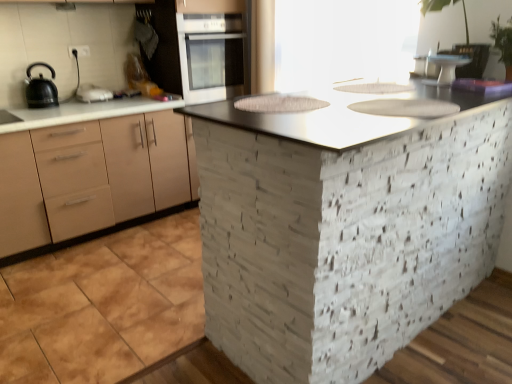
Measure the distance between green leafy plant at upper right and camera.

green leafy plant at upper right is 6.61 feet from camera.

Measure the distance between metallic gray countertop at center and camera.

They are 3.50 feet apart.

Find the location of `white glossy sink at upper center, which ranks as the second sink in bottom-to-top order`. white glossy sink at upper center, which ranks as the second sink in bottom-to-top order is located at coordinates (375, 88).

What do you see at coordinates (211, 56) in the screenshot?
I see `white glossy oven at upper center` at bounding box center [211, 56].

In order to click on white glossy sink at center, arranged as the first sink when ordered from the bottom in this screenshot , I will do `click(406, 107)`.

Considering the sizes of transparent glass window screen at upper center and green leafy plant at upper right in the image, is transparent glass window screen at upper center taller or shorter than green leafy plant at upper right?

Considering their sizes, transparent glass window screen at upper center has more height than green leafy plant at upper right.

Locate an element on the screen. plant that appears below the transparent glass window screen at upper center (from the image's perspective) is located at coordinates (461, 24).

Is transparent glass window screen at upper center beside green leafy plant at upper right?

No, transparent glass window screen at upper center is not next to green leafy plant at upper right.

Does transparent glass window screen at upper center appear on the right side of green leafy plant at upper right?

No, transparent glass window screen at upper center is not to the right of green leafy plant at upper right.

Is matte black kettle at left wider or thinner than white glossy cake stand at upper right?

matte black kettle at left is wider than white glossy cake stand at upper right.

Are matte black kettle at left and white glossy cake stand at upper right located far from each other?

matte black kettle at left is positioned a significant distance from white glossy cake stand at upper right.

From the image's perspective, is matte black kettle at left positioned above or below white glossy cake stand at upper right?

matte black kettle at left is above white glossy cake stand at upper right.

Considering the relative sizes of matte black kettle at left and white glossy cake stand at upper right in the image provided, is matte black kettle at left bigger than white glossy cake stand at upper right?

Yes.

In the scene shown: From a real-world perspective, is white glossy oven at upper center positioned above or below metallic gray countertop at center?

white glossy oven at upper center is situated higher than metallic gray countertop at center in the real world.

Relative to metallic gray countertop at center, is white glossy oven at upper center in front or behind?

In the image, white glossy oven at upper center appears behind metallic gray countertop at center.

Is white glossy oven at upper center facing towards metallic gray countertop at center?

Yes.

Can you confirm if white glossy oven at upper center is bigger than metallic gray countertop at center?

No.

Is point (438, 54) closer or farther from the camera than point (320, 134)?

Point (438, 54) is positioned farther from the camera compared to point (320, 134).

Is the depth of white glossy cake stand at upper right greater than that of metallic gray countertop at center?

Yes.

Who is smaller, white glossy cake stand at upper right or metallic gray countertop at center?

white glossy cake stand at upper right.

Are white glossy cake stand at upper right and metallic gray countertop at center beside each other?

No, white glossy cake stand at upper right is not in contact with metallic gray countertop at center.

Is matte beige cabinet at left a part of white glossy sink at upper center, placed as the first sink when sorted from top to bottom?

No, matte beige cabinet at left is not inside white glossy sink at upper center, placed as the first sink when sorted from top to bottom.

Is white glossy sink at upper center, the second sink in the front-to-back sequence, in front of or behind matte beige cabinet at left in the image?

Visually, white glossy sink at upper center, the second sink in the front-to-back sequence, is located in front of matte beige cabinet at left.

Is white glossy sink at upper center, the second sink in the front-to-back sequence, with matte beige cabinet at left?

No, white glossy sink at upper center, the second sink in the front-to-back sequence, is not next to matte beige cabinet at left.

Which is behind, point (323, 3) or point (34, 87)?

Positioned behind is point (34, 87).

Locate an element on the screen. The width and height of the screenshot is (512, 384). window screen above the black matte kettle at left (from the image's perspective) is located at coordinates (343, 41).

Is black matte kettle at left at the back of transparent glass window screen at upper center?

No, transparent glass window screen at upper center is not facing the opposite direction of black matte kettle at left.

Where is `oven above the matte black kettle at left (from a real-world perspective)`? oven above the matte black kettle at left (from a real-world perspective) is located at coordinates (211, 56).

Considering the sizes of objects white glossy oven at upper center and matte black kettle at left in the image provided, who is wider, white glossy oven at upper center or matte black kettle at left?

white glossy oven at upper center.

Which of these two, white glossy oven at upper center or matte black kettle at left, is bigger?

With larger size is white glossy oven at upper center.

Locate an element on the screen. This screenshot has width=512, height=384. plant located above the transparent glass window screen at upper center (from a real-world perspective) is located at coordinates (461, 24).

Locate an element on the screen. The height and width of the screenshot is (384, 512). kitchen appliance behind the white glossy cake stand at upper right is located at coordinates (92, 93).

Based on their spatial positions, is white glossy oven at upper center or matte beige cabinet at left closer to white glossy cake stand at upper right?

white glossy oven at upper center lies closer to white glossy cake stand at upper right than the other object.

From the picture: Considering their positions, is white glossy sink at upper center, placed as the first sink when sorted from top to bottom, positioned further to white glossy oven at upper center than metallic gray countertop at center?

Based on the image, metallic gray countertop at center appears to be further to white glossy oven at upper center.

In the scene shown: Considering their positions, is green leafy plant at upper right positioned further to matte black kettle at left than white glossy cake stand at upper right?

Among the two, green leafy plant at upper right is located further to matte black kettle at left.

Looking at the image, which one is located further to black matte kettle at left, white glossy sink at upper center, which ranks as the second sink in bottom-to-top order, or white glossy sink at center, placed as the 1th sink when sorted from front to back?

The object further to black matte kettle at left is white glossy sink at center, placed as the 1th sink when sorted from front to back.

Estimate the real-world distances between objects in this image. Which object is further from matte beige cabinet at left, white glossy sink at center, arranged as the first sink when ordered from the bottom, or white glossy sink at upper center, placed as the first sink when sorted from top to bottom?

Among the two, white glossy sink at center, arranged as the first sink when ordered from the bottom, is located further to matte beige cabinet at left.

When comparing their distances from matte beige cabinet at left, does white glossy cake stand at upper right or white glossy sink at upper center, the second sink in the front-to-back sequence, seem closer?

white glossy sink at upper center, the second sink in the front-to-back sequence, lies closer to matte beige cabinet at left than the other object.

Based on their spatial positions, is metallic gray countertop at center or white glossy sink at center, placed as the 1th sink when sorted from front to back, closer to green leafy plant at upper right?

white glossy sink at center, placed as the 1th sink when sorted from front to back, lies closer to green leafy plant at upper right than the other object.

Looking at the image, which one is located further to matte black kettle at left, white glossy cake stand at upper right or matte beige cabinet at left?

white glossy cake stand at upper right.

Identify the location of appliance between black matte kettle at left and green leafy plant at upper right in the horizontal direction. (446, 68).

The image size is (512, 384). Find the location of `window screen between matte black kettle at left and green leafy plant at upper right from left to right`. window screen between matte black kettle at left and green leafy plant at upper right from left to right is located at coordinates (x=343, y=41).

You are a GUI agent. You are given a task and a screenshot of the screen. Output one action in this format:
    pyautogui.click(x=<x>, y=<y>)
    Task: Click on the appliance between matte black kettle at left and green leafy plant at upper right from left to right
    This screenshot has height=384, width=512.
    Given the screenshot: What is the action you would take?
    pyautogui.click(x=446, y=68)

Find the location of `oven between matte black kettle at left and green leafy plant at upper right from left to right`. oven between matte black kettle at left and green leafy plant at upper right from left to right is located at coordinates (211, 56).